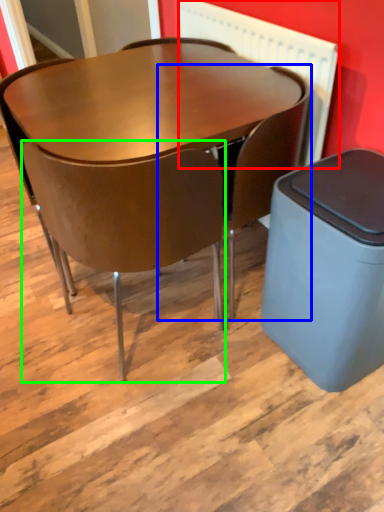
Question: Which is farther away from radiator (highlighted by a red box)? chair (highlighted by a blue box) or chair (highlighted by a green box)?

Choices:
 (A) chair
 (B) chair

Answer: (B)